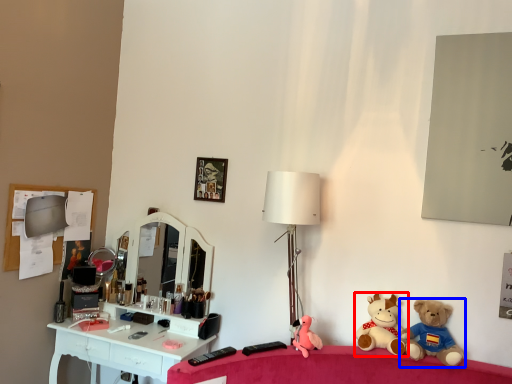
Question: Which object is further to the camera taking this photo, toy (highlighted by a red box) or toy (highlighted by a blue box)?

Choices:
 (A) toy
 (B) toy

Answer: (A)